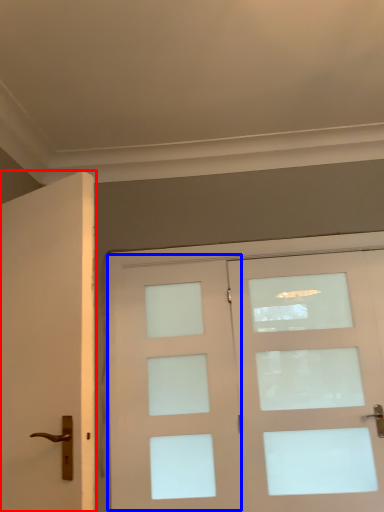
Question: Which object is closer to the camera taking this photo, door (highlighted by a red box) or screen door (highlighted by a blue box)?

Choices:
 (A) door
 (B) screen door

Answer: (A)